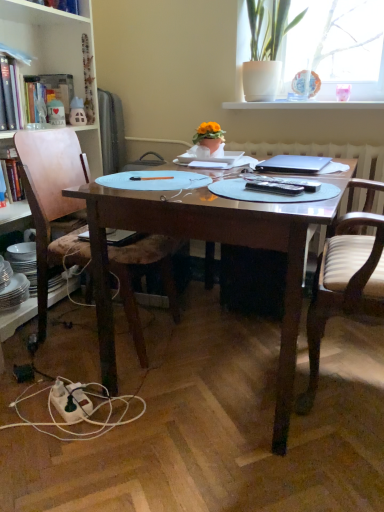
Question: Would you say white striped wood chair at right, marked as the second chair in a left-to-right arrangement, contains wooden desk at center?

Choices:
 (A) yes
 (B) no

Answer: (B)

Question: Is white striped wood chair at right, the first chair positioned from the right, at the right side of wooden desk at center?

Choices:
 (A) yes
 (B) no

Answer: (A)

Question: Can you confirm if white striped wood chair at right, the first chair positioned from the right, is shorter than wooden desk at center?

Choices:
 (A) yes
 (B) no

Answer: (B)

Question: Can you confirm if white striped wood chair at right, marked as the second chair in a left-to-right arrangement, is taller than wooden desk at center?

Choices:
 (A) yes
 (B) no

Answer: (A)

Question: From a real-world perspective, is white striped wood chair at right, marked as the second chair in a left-to-right arrangement, physically above wooden desk at center?

Choices:
 (A) no
 (B) yes

Answer: (B)

Question: Can you confirm if white striped wood chair at right, marked as the second chair in a left-to-right arrangement, is thinner than wooden desk at center?

Choices:
 (A) yes
 (B) no

Answer: (A)

Question: Does hardcover book at left, which is the second book from back to front, turn towards white ceramic pot at upper right?

Choices:
 (A) yes
 (B) no

Answer: (B)

Question: From a real-world perspective, does hardcover book at left, which is the second book from back to front, stand above white ceramic pot at upper right?

Choices:
 (A) no
 (B) yes

Answer: (A)

Question: From a real-world perspective, is hardcover book at left, acting as the 2th book starting from the front, below white ceramic pot at upper right?

Choices:
 (A) no
 (B) yes

Answer: (B)

Question: From the image's perspective, does hardcover book at left, which is the second book from back to front, appear lower than white ceramic pot at upper right?

Choices:
 (A) no
 (B) yes

Answer: (B)

Question: Would you say hardcover book at left, acting as the 2th book starting from the front, contains white ceramic pot at upper right?

Choices:
 (A) yes
 (B) no

Answer: (B)

Question: Considering the relative sizes of hardcover book at left, acting as the 2th book starting from the front, and white ceramic pot at upper right in the image provided, is hardcover book at left, acting as the 2th book starting from the front, shorter than white ceramic pot at upper right?

Choices:
 (A) yes
 (B) no

Answer: (A)

Question: Is white glossy window sill at upper center bigger than wooden chair at left, acting as the first chair starting from the left?

Choices:
 (A) no
 (B) yes

Answer: (A)